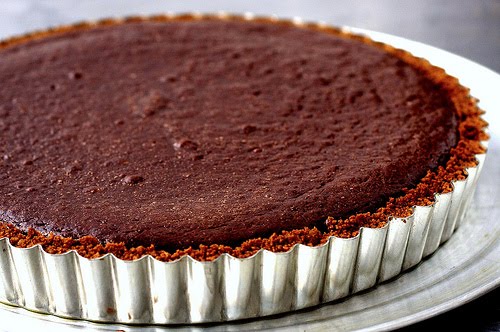
You are a GUI agent. You are given a task and a screenshot of the screen. Output one action in this format:
    pyautogui.click(x=<x>, y=<y>)
    Task: Click on the plate
    
    Given the screenshot: What is the action you would take?
    pyautogui.click(x=483, y=241), pyautogui.click(x=472, y=70)